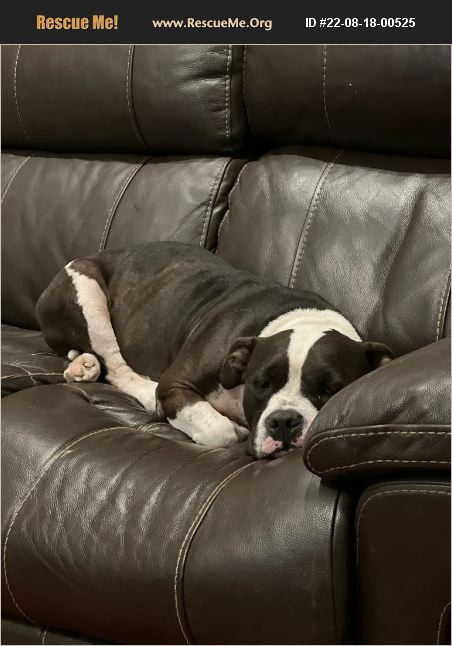
Identify the location of brown couch. (47, 368).